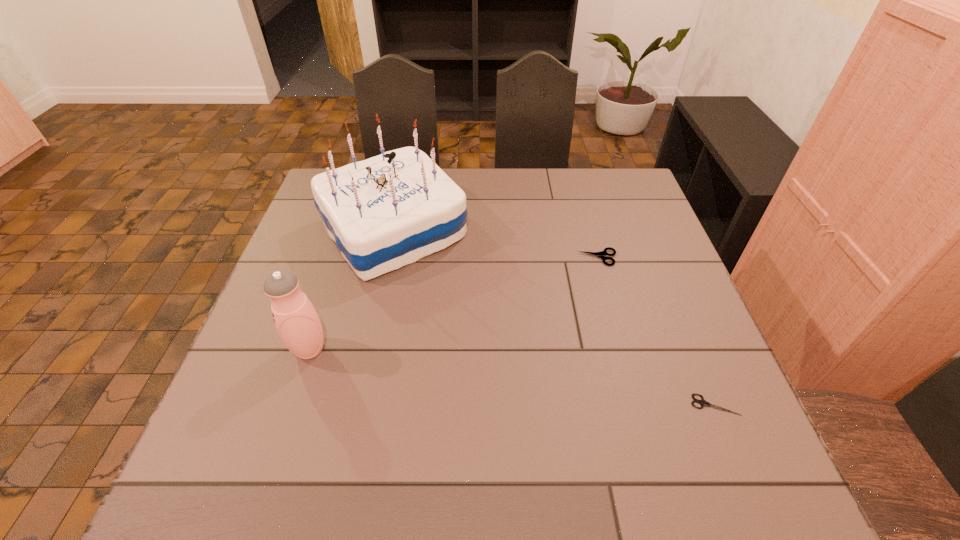
I want to click on free space at the far right corner of the desktop, so click(x=636, y=212).

You are a GUI agent. You are given a task and a screenshot of the screen. Output one action in this format:
    pyautogui.click(x=<x>, y=<y>)
    Task: Click on the vacant area at the near right corner
    This screenshot has width=960, height=540.
    Given the screenshot: What is the action you would take?
    pyautogui.click(x=710, y=484)

The height and width of the screenshot is (540, 960). I want to click on free space that is in between the left shears and the birthday cake, so click(x=495, y=244).

Identify the location of empty location between the second nearest object and the tallest object. The width and height of the screenshot is (960, 540). (351, 290).

I want to click on free area in between the second shortest object and the third farthest object, so (454, 303).

I want to click on free area in between the second nearest object and the birthday cake, so click(351, 290).

Identify the location of vacant space that's between the second tallest object and the third object from left to right. This screenshot has height=540, width=960. (454, 303).

Identify the location of vacant region between the second nearest object and the rightmost object. (512, 377).

At what (x,y) coordinates should I click in order to perform the action: click on free point between the tallest object and the taller shears. Please return your answer as a coordinate pair (x, y). This screenshot has height=540, width=960. Looking at the image, I should click on (495, 244).

The height and width of the screenshot is (540, 960). I want to click on free point between the shorter shears and the tallest object, so click(x=554, y=318).